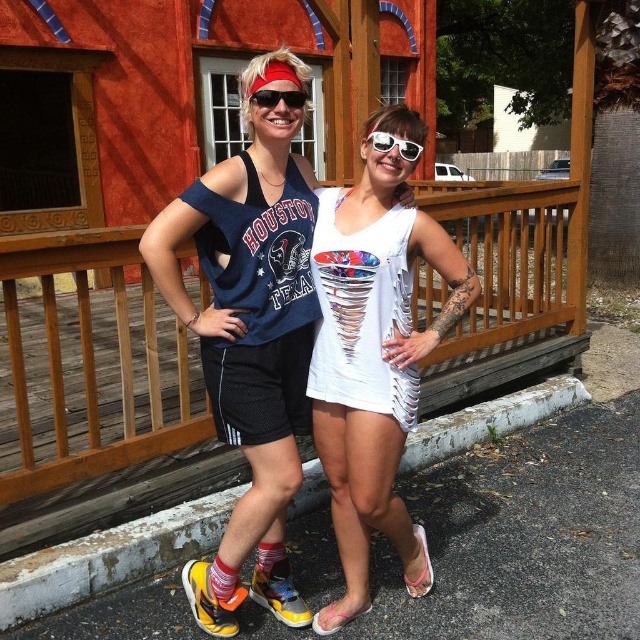
Question: Which object is the closest to the red reflective sunglasses at center?

Choices:
 (A) matte black tank top at center
 (B) white reflective sunglasses at center
 (C) white textured dress at center
 (D) wooden rail at center

Answer: (B)

Question: Is matte black tank top at center bigger than wooden rail at center?

Choices:
 (A) no
 (B) yes

Answer: (A)

Question: Among these objects, which one is farthest from the camera?

Choices:
 (A) white reflective sunglasses at center
 (B) red reflective sunglasses at center
 (C) white textured dress at center
 (D) matte black tank top at center

Answer: (A)

Question: Among these objects, which one is nearest to the camera?

Choices:
 (A) white reflective sunglasses at center
 (B) red reflective sunglasses at center

Answer: (B)

Question: Does matte black tank top at center appear over wooden rail at center?

Choices:
 (A) no
 (B) yes

Answer: (A)

Question: Is wooden rail at center to the left of red reflective sunglasses at center from the viewer's perspective?

Choices:
 (A) yes
 (B) no

Answer: (B)